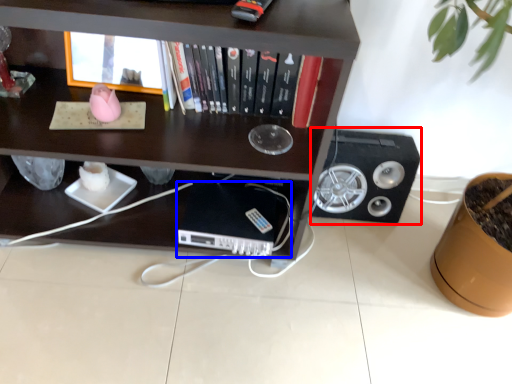
Question: Which object appears closest to the camera in this image, speaker (highlighted by a red box) or computer (highlighted by a blue box)?

Choices:
 (A) speaker
 (B) computer

Answer: (B)